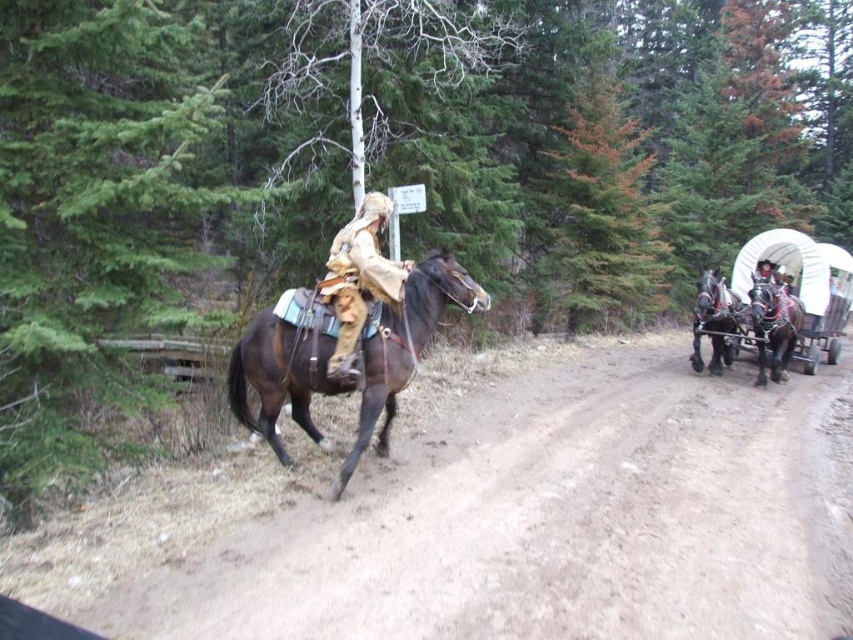
You are standing at the point labeled point (x=361, y=371) and want to walk to the point labeled point (x=651, y=388). According to the scene, which direction should you face to move towards your destination?

Result: You should face towards the back of the scene because point (x=651, y=388) is behind point (x=361, y=371).

You are a hiker who wants to follow the shiny brown horse at right along the brown sandy dirt track at center. Which direction should you go to stay on the path?

To follow the shiny brown horse at right along the brown sandy dirt track at center, you should go to the left since the brown sandy dirt track at center is to the left of the shiny brown horse at right.